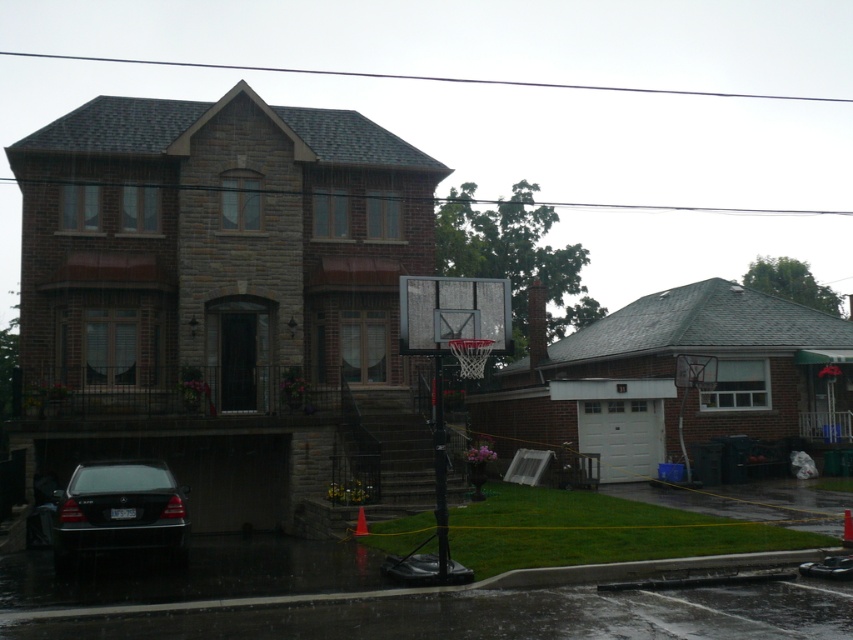
Question: Can you confirm if metallic silver basketball hoop at center is wider than shiny black sedan at lower left?

Choices:
 (A) no
 (B) yes

Answer: (A)

Question: From the image, what is the correct spatial relationship of metallic silver basketball hoop at center in relation to shiny black sedan at lower left?

Choices:
 (A) above
 (B) below

Answer: (A)

Question: Is metallic silver basketball hoop at center bigger than shiny black sedan at lower left?

Choices:
 (A) no
 (B) yes

Answer: (A)

Question: Which point is closer to the camera?

Choices:
 (A) metallic silver basketball hoop at center
 (B) shiny black sedan at lower left

Answer: (A)

Question: Which object appears closest to the camera in this image?

Choices:
 (A) shiny black sedan at lower left
 (B) metallic silver basketball hoop at center

Answer: (B)